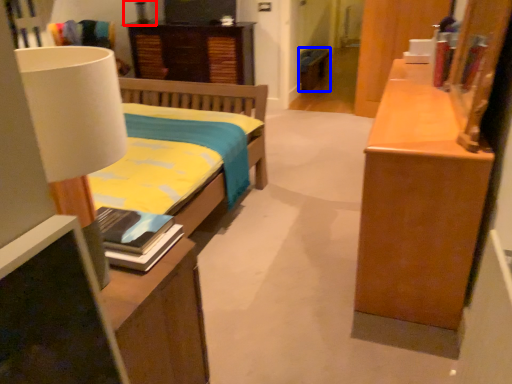
Question: Among these objects, which one is farthest to the camera, lamp (highlighted by a red box) or cabinetry (highlighted by a blue box)?

Choices:
 (A) lamp
 (B) cabinetry

Answer: (B)